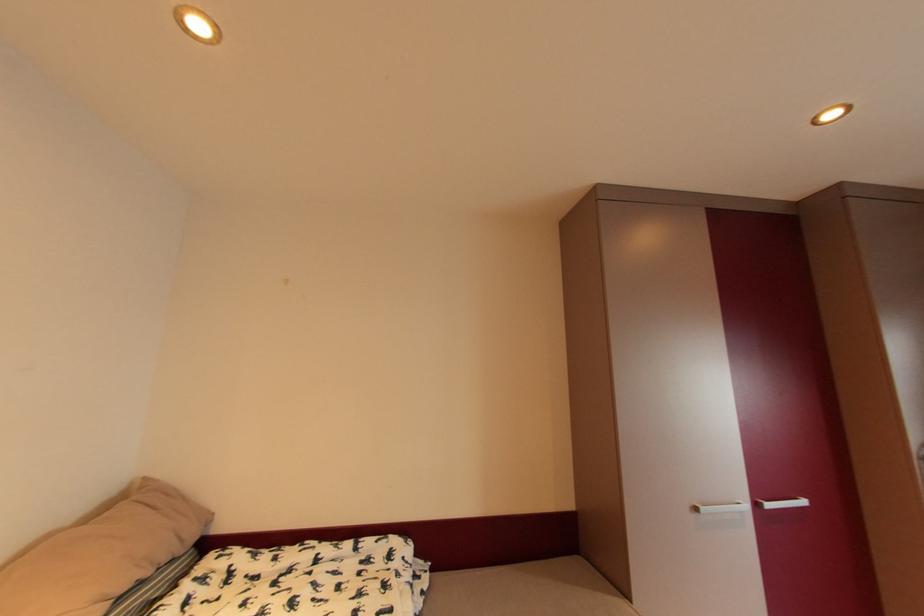
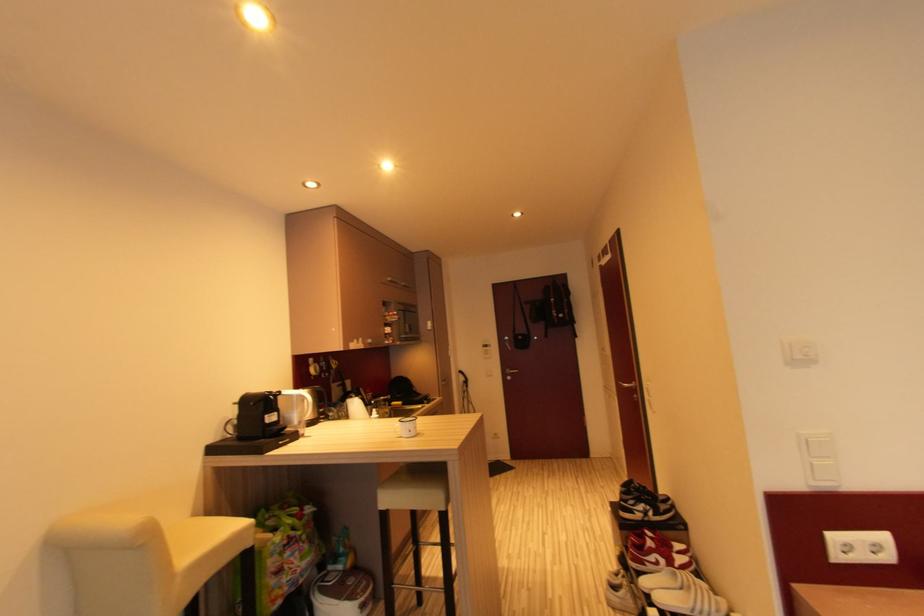
Question: The camera is either moving clockwise (left) or counter-clockwise (right) around the object. The first image is from the beginning of the video and the second image is from the end. Is the camera moving left or right when shooting the video?

Choices:
 (A) Left
 (B) Right

Answer: (B)